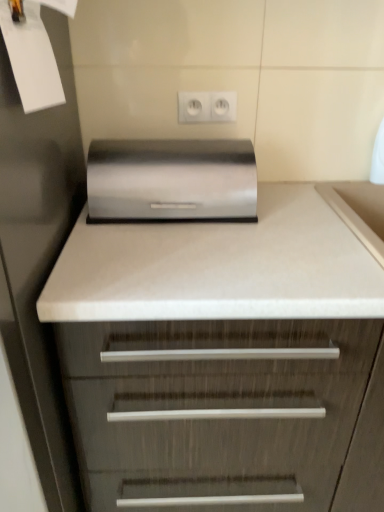
Question: Should I look upward or downward to see satin wood chest of drawers at center?

Choices:
 (A) up
 (B) down

Answer: (B)

Question: Considering the relative positions of satin wood chest of drawers at center and satin metallic breadbox at center in the image provided, is satin wood chest of drawers at center to the right of satin metallic breadbox at center from the viewer's perspective?

Choices:
 (A) yes
 (B) no

Answer: (A)

Question: Considering the relative positions of satin wood chest of drawers at center and satin metallic breadbox at center in the image provided, is satin wood chest of drawers at center to the left of satin metallic breadbox at center from the viewer's perspective?

Choices:
 (A) no
 (B) yes

Answer: (A)

Question: Is satin wood chest of drawers at center not close to satin metallic breadbox at center?

Choices:
 (A) yes
 (B) no

Answer: (B)

Question: Is satin wood chest of drawers at center oriented away from satin metallic breadbox at center?

Choices:
 (A) yes
 (B) no

Answer: (B)

Question: Is satin wood chest of drawers at center thinner than satin metallic breadbox at center?

Choices:
 (A) no
 (B) yes

Answer: (A)

Question: Does satin wood chest of drawers at center have a greater height compared to satin metallic breadbox at center?

Choices:
 (A) no
 (B) yes

Answer: (B)

Question: Is white paper at upper left closer to the viewer compared to satin metallic breadbox at center?

Choices:
 (A) no
 (B) yes

Answer: (B)

Question: From a real-world perspective, is white paper at upper left located beneath satin metallic breadbox at center?

Choices:
 (A) yes
 (B) no

Answer: (B)

Question: Is white paper at upper left facing away from satin metallic breadbox at center?

Choices:
 (A) yes
 (B) no

Answer: (B)

Question: Is white paper at upper left taller than satin metallic breadbox at center?

Choices:
 (A) yes
 (B) no

Answer: (A)

Question: Is white paper at upper left far from satin metallic breadbox at center?

Choices:
 (A) yes
 (B) no

Answer: (B)

Question: From a real-world perspective, does white paper at upper left stand above satin metallic breadbox at center?

Choices:
 (A) no
 (B) yes

Answer: (B)

Question: Is satin metallic breadbox at center touching white plastic electric outlet at upper center?

Choices:
 (A) yes
 (B) no

Answer: (B)